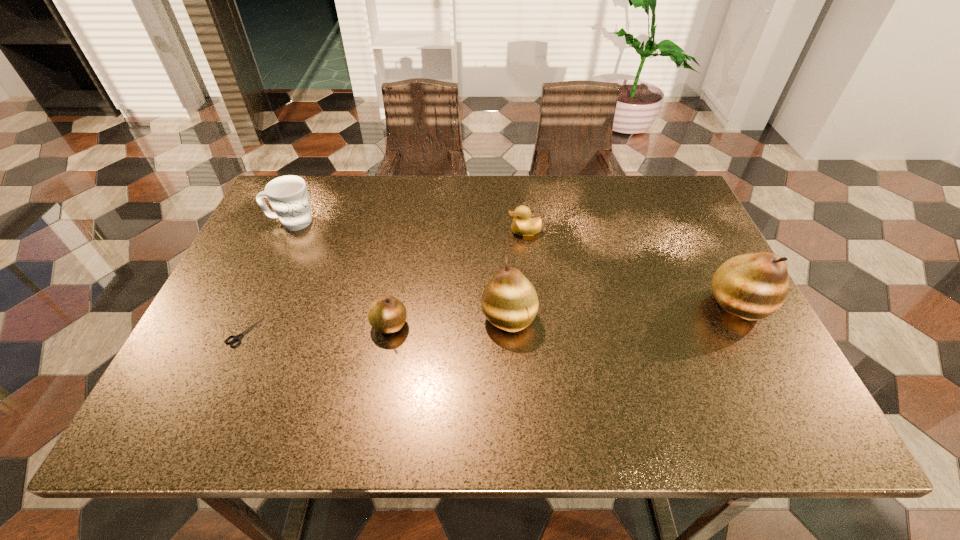
What are the coordinates of `the third object from left to right` in the screenshot? It's located at (387, 314).

In order to click on the leftmost pear in this screenshot , I will do `click(387, 314)`.

The image size is (960, 540). Identify the location of the second pear from left to right. click(509, 301).

Where is `the second shortest pear`? Image resolution: width=960 pixels, height=540 pixels. the second shortest pear is located at coordinates (509, 301).

Find the location of `the rightmost pear`. the rightmost pear is located at coordinates (753, 286).

Image resolution: width=960 pixels, height=540 pixels. I want to click on mug, so click(288, 195).

Identify the location of the shortest object. (235, 338).

The image size is (960, 540). What are the coordinates of `the fifth tallest object` in the screenshot? It's located at (522, 225).

Find the location of a particular element. free spot located 0.060m on the front of the fourth object from right to left is located at coordinates click(x=383, y=363).

Find the location of `vacant position located 0.260m on the back of the fifth shortest object`. vacant position located 0.260m on the back of the fifth shortest object is located at coordinates (503, 227).